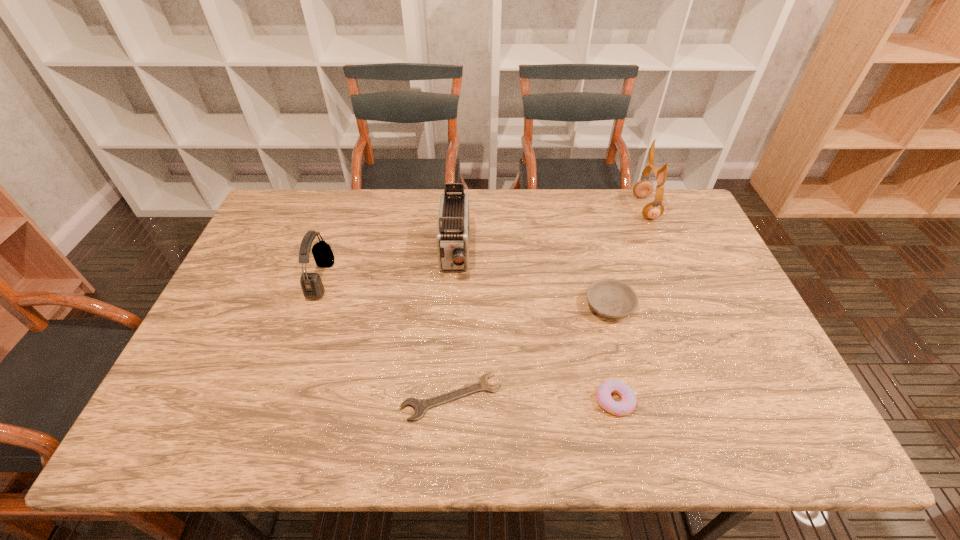
Image resolution: width=960 pixels, height=540 pixels. What are the coordinates of `blank space that satisfies the following two spatial constraints: 1. at the lens of the camcorder; 2. on the headband of the headset` in the screenshot? It's located at (453, 279).

Image resolution: width=960 pixels, height=540 pixels. I want to click on vacant space that satisfies the following two spatial constraints: 1. at the lens of the camcorder; 2. on the headband of the leftmost object, so click(x=453, y=279).

The image size is (960, 540). What are the coordinates of `free space that satisfies the following two spatial constraints: 1. on the headband of the bowl; 2. on the left side of the headset` in the screenshot? It's located at (312, 306).

The height and width of the screenshot is (540, 960). What are the coordinates of `free point that satisfies the following two spatial constraints: 1. on the headband of the leftmost object; 2. on the back side of the third shortest object` in the screenshot? It's located at (312, 306).

Where is `vacant area in the image that satisfies the following two spatial constraints: 1. at the lens of the camcorder; 2. on the headband of the third tallest object`? This screenshot has height=540, width=960. vacant area in the image that satisfies the following two spatial constraints: 1. at the lens of the camcorder; 2. on the headband of the third tallest object is located at coordinates (453, 279).